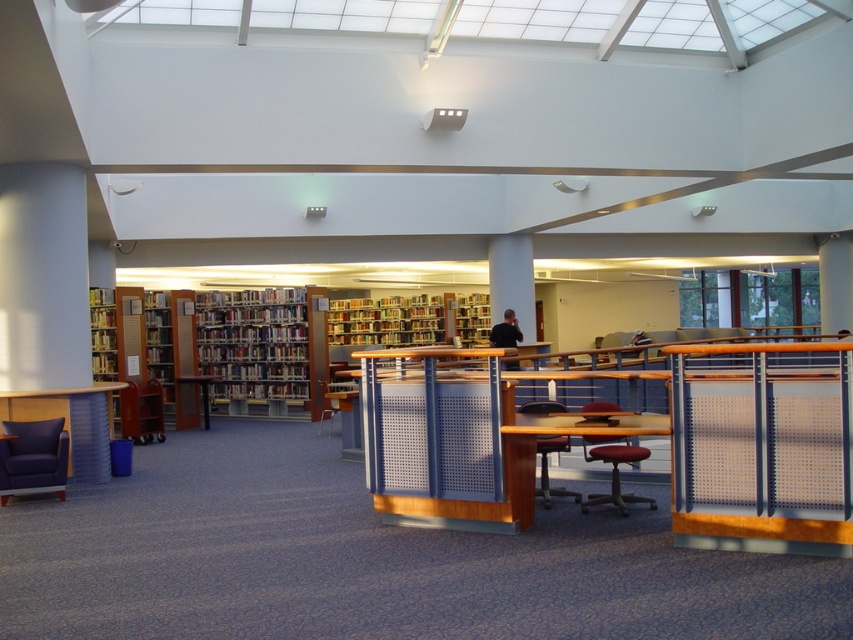
Does point (61, 448) come farther from viewer compared to point (550, 404)?

Yes.

Which of these two, dark blue fabric swivel chair at lower left or matte black chair at center, stands taller?

dark blue fabric swivel chair at lower left

The width and height of the screenshot is (853, 640). What do you see at coordinates (32, 458) in the screenshot?
I see `dark blue fabric swivel chair at lower left` at bounding box center [32, 458].

Where is `dark blue fabric swivel chair at lower left`? The height and width of the screenshot is (640, 853). dark blue fabric swivel chair at lower left is located at coordinates (32, 458).

Does dark blue fabric swivel chair at lower left appear under red leather office chair at center?

Correct, dark blue fabric swivel chair at lower left is located below red leather office chair at center.

Does dark blue fabric swivel chair at lower left appear on the left side of red leather office chair at center?

Correct, you'll find dark blue fabric swivel chair at lower left to the left of red leather office chair at center.

Is point (7, 488) closer to camera compared to point (601, 456)?

No, (7, 488) is further to viewer.

Image resolution: width=853 pixels, height=640 pixels. I want to click on dark blue fabric swivel chair at lower left, so click(x=32, y=458).

Is wooden bookshelf at center wider than dark blue fabric swivel chair at lower left?

Yes.

Does wooden bookshelf at center have a greater height compared to dark blue fabric swivel chair at lower left?

Indeed, wooden bookshelf at center has a greater height compared to dark blue fabric swivel chair at lower left.

Between point (256, 307) and point (9, 490), which one is positioned in front?

Point (9, 490) is more forward.

Where is `wooden bookshelf at center`? wooden bookshelf at center is located at coordinates (254, 346).